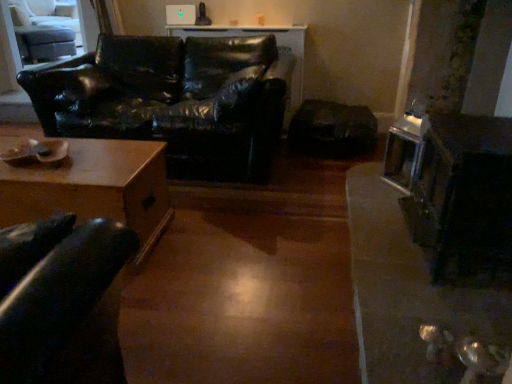
Where is `vacant space situated on the left part of metallic silver fireplace at right`? This screenshot has height=384, width=512. vacant space situated on the left part of metallic silver fireplace at right is located at coordinates (386, 265).